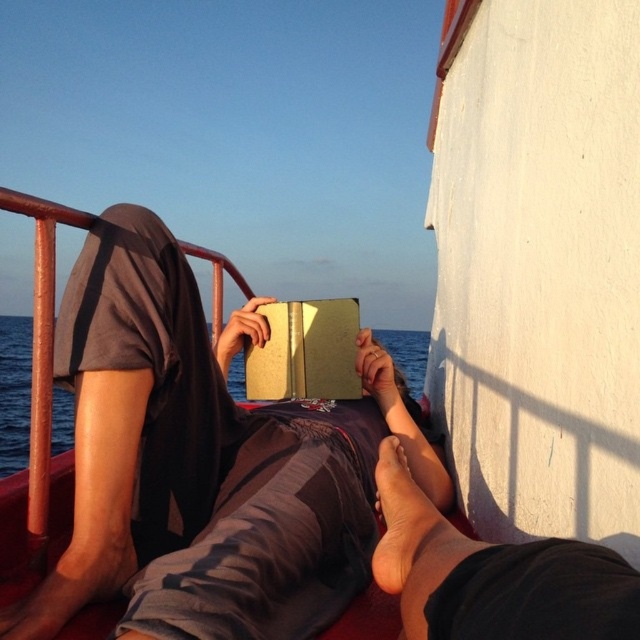
You are trying to decide which book to read next. You have two options on the boat deck at center, the matte brown book at center and the gold paper book at center. Which one is shorter in height?

The matte brown book at center is not as tall as the gold paper book at center, so the matte brown book at center is shorter in height.